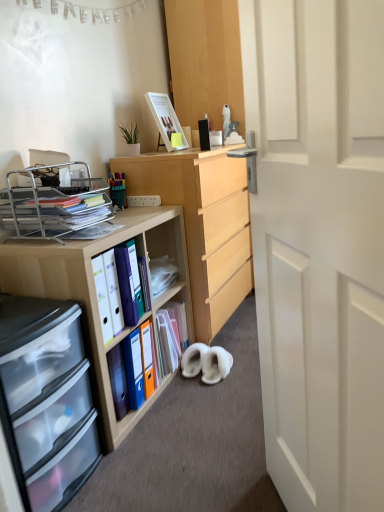
Locate an element on the screen. The height and width of the screenshot is (512, 384). free space in front of white fluffy slippers at lower center, positioned as the 1th footwear in right-to-left order is located at coordinates (221, 394).